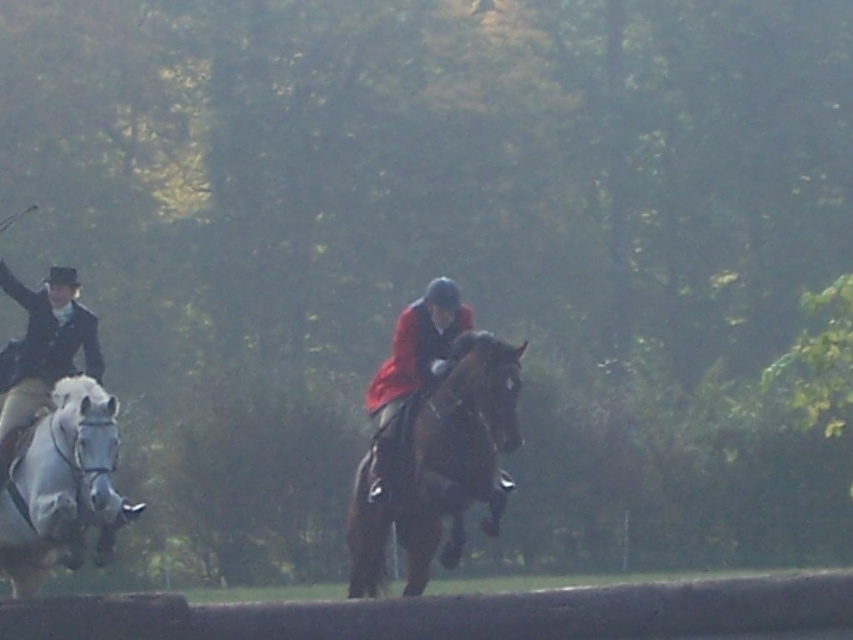
Question: Does white glossy horse at left appear on the right side of red velvet jacket at center?

Choices:
 (A) no
 (B) yes

Answer: (A)

Question: Which of the following is the farthest from the observer?

Choices:
 (A) shiny brown horse at center
 (B) red velvet jacket at center

Answer: (B)

Question: Does shiny brown horse at center lie in front of red velvet jacket at center?

Choices:
 (A) yes
 (B) no

Answer: (A)

Question: Which is farther from the red velvet jacket at center?

Choices:
 (A) shiny brown horse at center
 (B) white glossy horse at left

Answer: (B)

Question: Can you confirm if shiny brown horse at center is positioned above red velvet jacket at center?

Choices:
 (A) yes
 (B) no

Answer: (B)

Question: Which object is farther from the camera taking this photo?

Choices:
 (A) shiny brown horse at center
 (B) white glossy horse at left
 (C) red velvet jacket at center

Answer: (C)